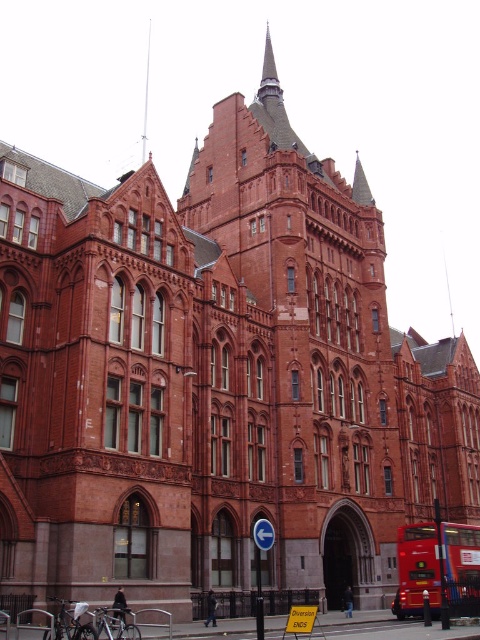
Question: Does red metallic bus at lower right appear over smooth silver spire at upper center?

Choices:
 (A) no
 (B) yes

Answer: (A)

Question: Is red metallic bus at lower right to the left of smooth silver spire at upper center from the viewer's perspective?

Choices:
 (A) yes
 (B) no

Answer: (B)

Question: Is red metallic bus at lower right thinner than smooth silver spire at upper center?

Choices:
 (A) yes
 (B) no

Answer: (B)

Question: Which of the following is the closest to the observer?

Choices:
 (A) (466, 596)
 (B) (141, 141)

Answer: (A)

Question: Which of the following is the farthest from the observer?

Choices:
 (A) (143, 147)
 (B) (450, 579)

Answer: (A)